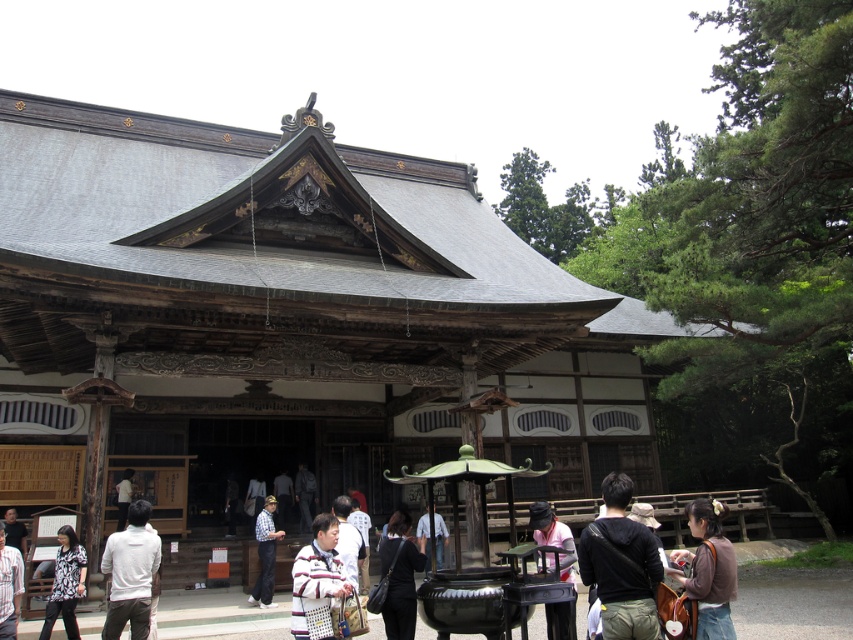
Is black fabric backpack at lower right smaller than brown fabric bag at lower right?

Indeed, black fabric backpack at lower right has a smaller size compared to brown fabric bag at lower right.

Can you confirm if black fabric backpack at lower right is bigger than brown fabric bag at lower right?

No, black fabric backpack at lower right is not bigger than brown fabric bag at lower right.

Who is more distant from viewer, [633,577] or [700,602]?

The point [700,602] is behind.

The height and width of the screenshot is (640, 853). I want to click on black fabric backpack at lower right, so click(621, 564).

Between point (70, 540) and point (4, 632), which one is positioned in front?

Point (4, 632) is more forward.

Is matte black shirt at center above white cotton shirt at lower left?

Actually, matte black shirt at center is below white cotton shirt at lower left.

This screenshot has height=640, width=853. What do you see at coordinates (65, 582) in the screenshot?
I see `matte black shirt at center` at bounding box center [65, 582].

Identify the location of matte black shirt at center. The height and width of the screenshot is (640, 853). (65, 582).

Is point (149, 573) positioned after point (293, 609)?

Yes, point (149, 573) is behind point (293, 609).

Is white matte shirt at center to the left of striped sweater at center from the viewer's perspective?

Correct, you'll find white matte shirt at center to the left of striped sweater at center.

Is point (132, 582) in front of point (334, 563)?

No, it is not.

This screenshot has height=640, width=853. In order to click on white matte shirt at center in this screenshot , I will do `click(131, 573)`.